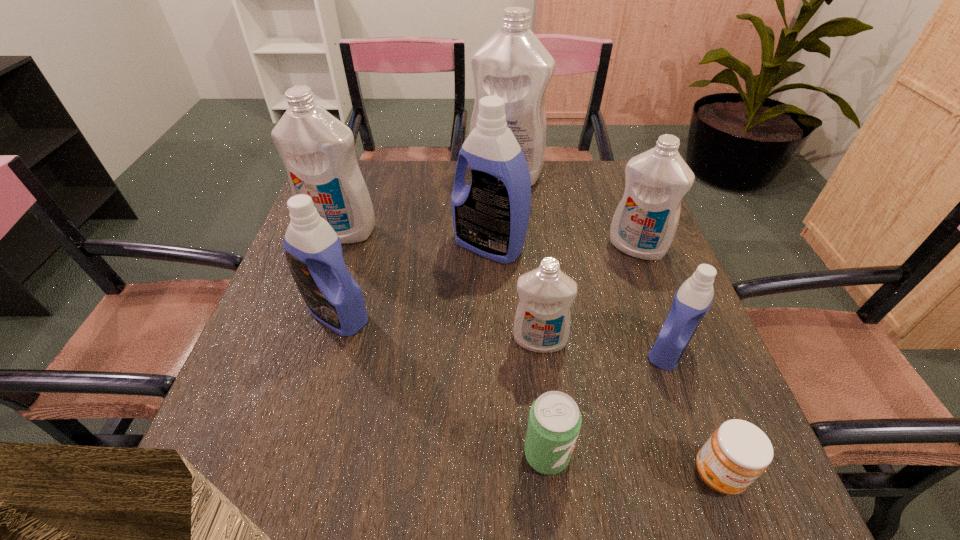
This screenshot has width=960, height=540. I want to click on object that is the second nearest to the second blue detergent from left to right, so click(x=542, y=320).

What are the coordinates of `detergent object that ranks as the fourth closest to the second smallest blue detergent` in the screenshot? It's located at (513, 64).

Select which detergent appears as the closest to the leftmost blue detergent. Please provide its 2D coordinates. Your answer should be formatted as a tuple, i.e. [(x, y)], where the tuple contains the x and y coordinates of a point satisfying the conditions above.

[(317, 149)]

Identify the location of white detergent that can be found as the fourth closest to the second blue detergent from left to right. (645, 222).

Identify which white detergent is the second closest to the third smallest white detergent. Please provide its 2D coordinates. Your answer should be formatted as a tuple, i.e. [(x, y)], where the tuple contains the x and y coordinates of a point satisfying the conditions above.

[(542, 320)]

Locate an element on the screen. Image resolution: width=960 pixels, height=540 pixels. blue detergent that is the third closest to the smallest white detergent is located at coordinates (313, 251).

Find the location of a particular element. The width and height of the screenshot is (960, 540). blue detergent that is the closest to the leftmost blue detergent is located at coordinates (490, 217).

Identify the location of blank space that satisfies the following two spatial constraints: 1. on the back side of the second shortest object; 2. on the left side of the rightmost blue detergent. Image resolution: width=960 pixels, height=540 pixels. (536, 349).